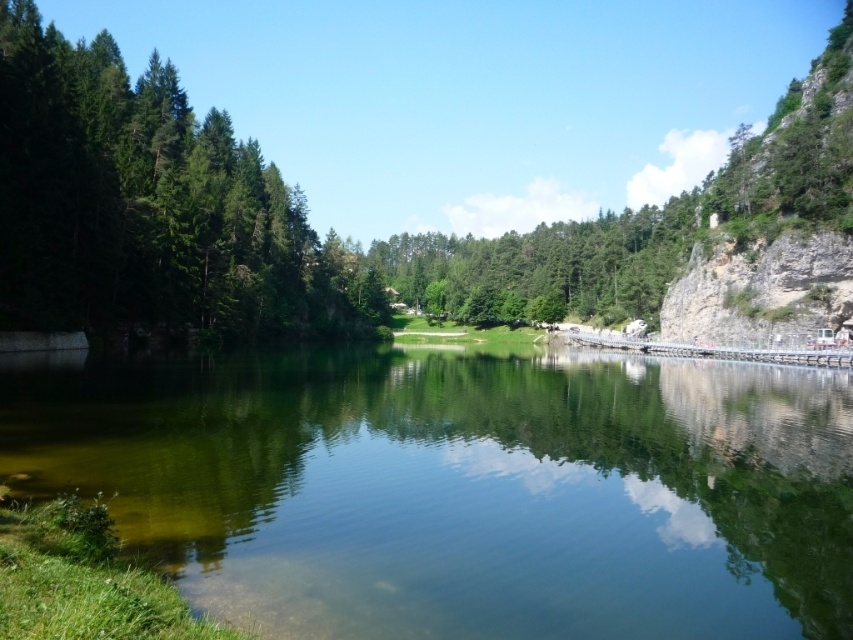
Can you confirm if green reflective water at center is bigger than green matte tree at center?

No, green reflective water at center is not bigger than green matte tree at center.

Does green reflective water at center have a greater height compared to green matte tree at center?

No, green reflective water at center is not taller than green matte tree at center.

This screenshot has height=640, width=853. What do you see at coordinates (460, 486) in the screenshot? I see `green reflective water at center` at bounding box center [460, 486].

Image resolution: width=853 pixels, height=640 pixels. I want to click on green reflective water at center, so click(460, 486).

Which is in front, point (154, 388) or point (328, 273)?

Point (154, 388) is in front.

Is point (111, 364) less distant than point (160, 113)?

Yes, it is.

What do you see at coordinates (460, 486) in the screenshot?
I see `green reflective water at center` at bounding box center [460, 486].

Identify the location of green reflective water at center. (460, 486).

Which is below, green matte tree at center or green matte trees at left?

green matte trees at left is lower down.

Is green matte tree at center positioned in front of green matte trees at left?

No, green matte tree at center is further to the viewer.

Does point (30, 132) come farther from viewer compared to point (35, 291)?

That is True.

In order to click on green matte tree at center in this screenshot , I will do `click(306, 216)`.